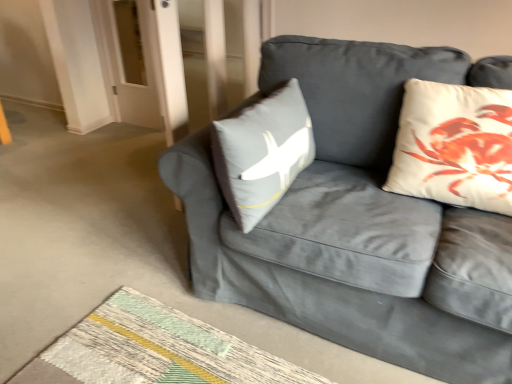
The image size is (512, 384). What are the coordinates of `textured woven mat at lower center` in the screenshot? It's located at (155, 350).

Is velvet gray couch at center turned away from textured woven mat at lower center?

No, velvet gray couch at center is not facing away from textured woven mat at lower center.

Considering the positions of objects velvet gray couch at center and textured woven mat at lower center in the image provided, who is more to the left, velvet gray couch at center or textured woven mat at lower center?

From the viewer's perspective, textured woven mat at lower center appears more on the left side.

Which object is closer to the camera taking this photo, velvet gray couch at center or textured woven mat at lower center?

velvet gray couch at center is closer to the camera.

Could you tell me if textured woven mat at lower center is turned towards white cotton cushion at upper right?

No, textured woven mat at lower center does not turn towards white cotton cushion at upper right.

From the image's perspective, is textured woven mat at lower center above or below white cotton cushion at upper right?

From the image's perspective, textured woven mat at lower center appears below white cotton cushion at upper right.

How many degrees apart are the facing directions of textured woven mat at lower center and white cotton cushion at upper right?

There is a 178-degree angle between the facing directions of textured woven mat at lower center and white cotton cushion at upper right.

Between textured woven mat at lower center and white cotton cushion at upper right, which one has larger width?

textured woven mat at lower center.

Find the location of a particular element. This screenshot has height=384, width=512. studio couch in front of the textured woven mat at lower center is located at coordinates (355, 220).

Is textured woven mat at lower center beside velvet gray couch at center?

They are not placed beside each other.

Which point is more forward, [47,362] or [465,64]?

Point [47,362]

Is textured woven mat at lower center oriented away from velvet gray couch at center?

textured woven mat at lower center does not have its back to velvet gray couch at center.

Considering the sizes of objects white cotton cushion at upper right and velvet gray couch at center in the image provided, who is taller, white cotton cushion at upper right or velvet gray couch at center?

velvet gray couch at center is taller.

From a real-world perspective, is white cotton cushion at upper right beneath velvet gray couch at center?

No, from a real-world perspective, white cotton cushion at upper right is not under velvet gray couch at center.

From the image's perspective, which object appears higher, velvet gray couch at center or white cotton cushion at upper right?

white cotton cushion at upper right, from the image's perspective.

Considering the relative positions of velvet gray couch at center and white cotton cushion at upper right in the image provided, is velvet gray couch at center to the left or to the right of white cotton cushion at upper right?

velvet gray couch at center is to the left of white cotton cushion at upper right.

The width and height of the screenshot is (512, 384). What are the coordinates of `studio couch on the left of white cotton cushion at upper right` in the screenshot? It's located at (355, 220).

Could you tell me if white cotton cushion at upper right is facing textured woven mat at lower center?

No, white cotton cushion at upper right is not facing towards textured woven mat at lower center.

Are white cotton cushion at upper right and textured woven mat at lower center located far from each other?

No, there isn't a large distance between white cotton cushion at upper right and textured woven mat at lower center.

Who is shorter, white cotton cushion at upper right or textured woven mat at lower center?

With less height is textured woven mat at lower center.

Considering the sizes of objects white cotton cushion at upper right and textured woven mat at lower center in the image provided, who is smaller, white cotton cushion at upper right or textured woven mat at lower center?

Smaller between the two is textured woven mat at lower center.

Locate an element on the screen. The image size is (512, 384). mat behind the velvet gray couch at center is located at coordinates (155, 350).

Locate an element on the screen. The height and width of the screenshot is (384, 512). mat that is on the left side of white cotton cushion at upper right is located at coordinates (155, 350).

When comparing their distances from white cotton cushion at upper right, does velvet gray couch at center or textured woven mat at lower center seem further?

Based on the image, textured woven mat at lower center appears to be further to white cotton cushion at upper right.

Considering their positions, is white cotton cushion at upper right positioned further to velvet gray couch at center than textured woven mat at lower center?

textured woven mat at lower center is further to velvet gray couch at center.

From the image, which object appears to be farther from textured woven mat at lower center, white cotton cushion at upper right or velvet gray couch at center?

Based on the image, white cotton cushion at upper right appears to be further to textured woven mat at lower center.

Considering their positions, is textured woven mat at lower center positioned closer to velvet gray couch at center than white cotton cushion at upper right?

white cotton cushion at upper right lies closer to velvet gray couch at center than the other object.

From the image, which object appears to be farther from textured woven mat at lower center, velvet gray couch at center or white cotton cushion at upper right?

white cotton cushion at upper right is further to textured woven mat at lower center.

Which object lies further to the anchor point white cotton cushion at upper right, textured woven mat at lower center or velvet gray couch at center?

textured woven mat at lower center is positioned further to the anchor white cotton cushion at upper right.

Where is `studio couch between textured woven mat at lower center and white cotton cushion at upper right in the horizontal direction`? The height and width of the screenshot is (384, 512). studio couch between textured woven mat at lower center and white cotton cushion at upper right in the horizontal direction is located at coordinates (355, 220).